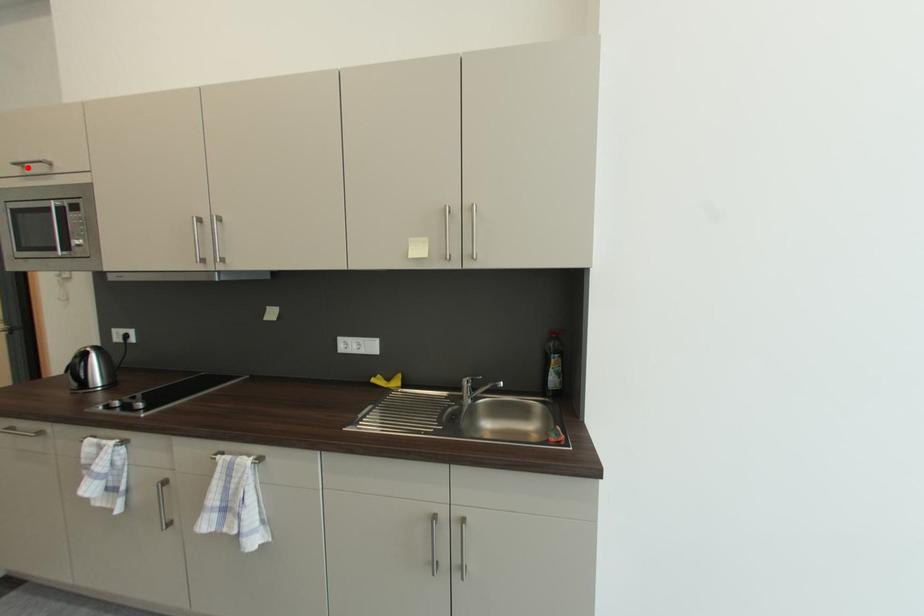
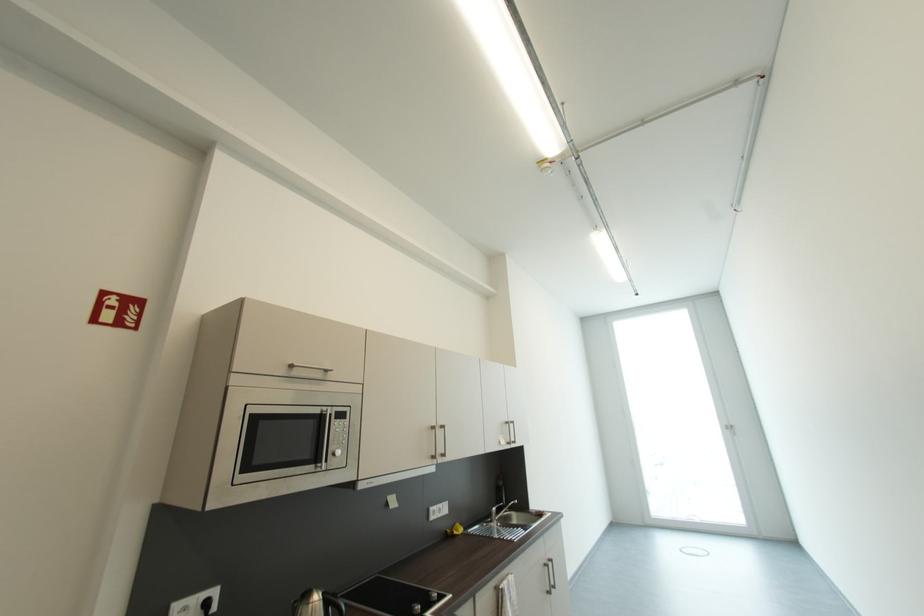
The point at the highlighted location is marked in the first image. Where is the corresponding point in the second image?

(298, 368)